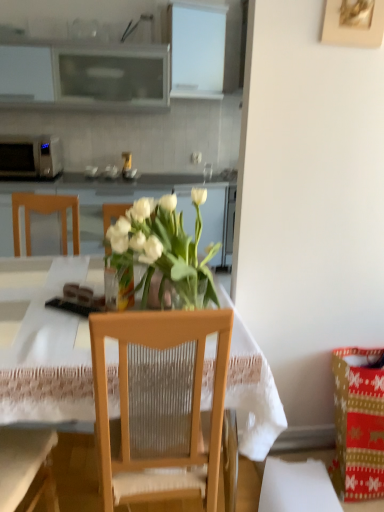
Image resolution: width=384 pixels, height=512 pixels. Identify the location of free space in front of clear glass vase at center. (77, 334).